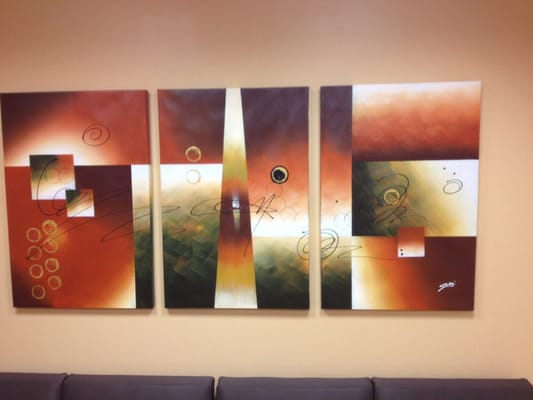
The width and height of the screenshot is (533, 400). I want to click on three canvases, so click(x=411, y=132), click(x=265, y=126), click(x=101, y=141).